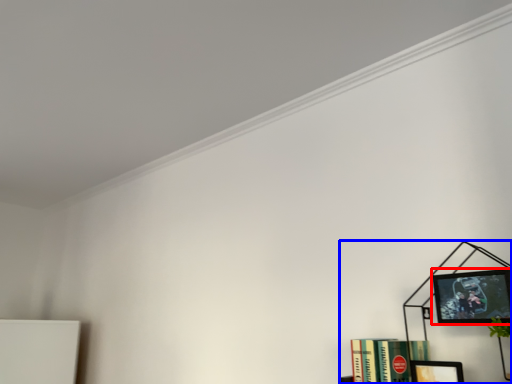
Question: Which object appears closest to the camera in this image, picture frame (highlighted by a red box) or bookcase (highlighted by a blue box)?

Choices:
 (A) picture frame
 (B) bookcase

Answer: (B)